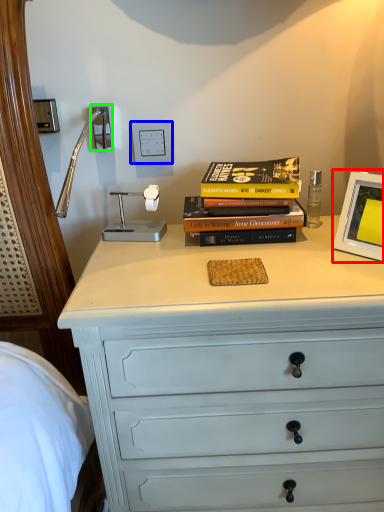
Question: Considering the real-world distances, which object is farthest from picture frame (highlighted by a red box)? electric outlet (highlighted by a blue box) or electric outlet (highlighted by a green box)?

Choices:
 (A) electric outlet
 (B) electric outlet

Answer: (B)